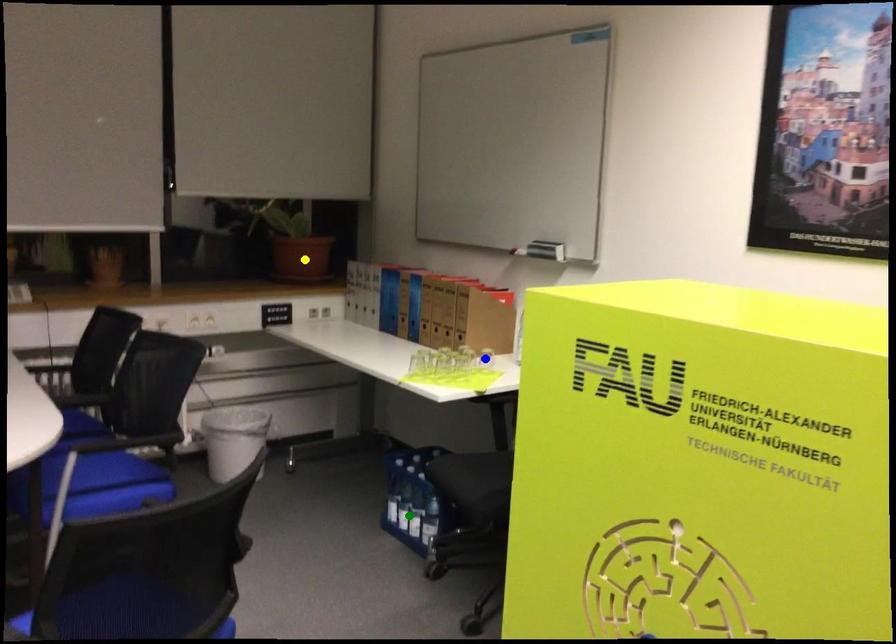
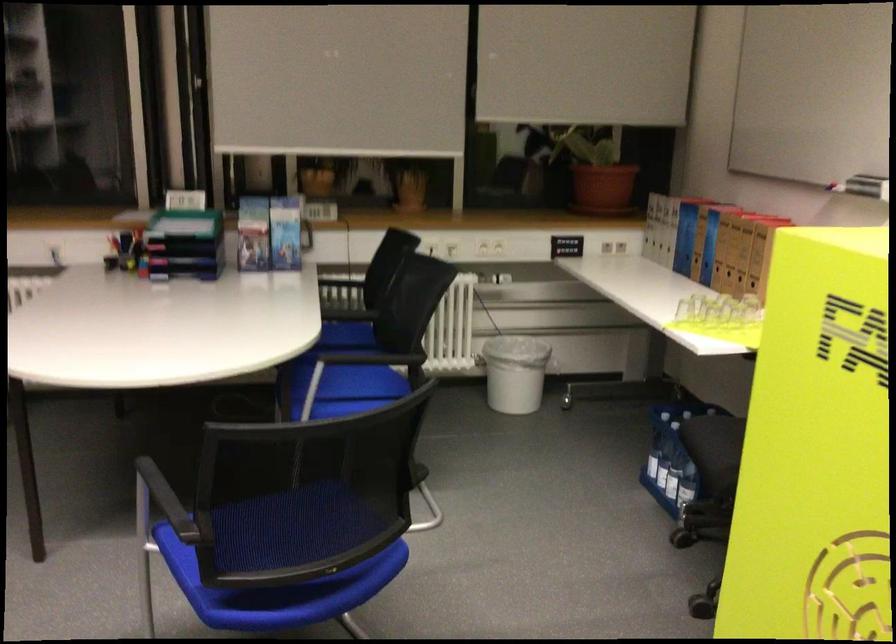
I am providing you with two images of the same scene from different viewpoints. Three points are marked in image1. Which point corresponds to a part or object that is occluded in image2?In image1, three points are marked. Which of them correspond to a part or object that is occluded in image2?Among the three points shown in image1, which one corresponds to a part or object that is no longer visible due to occlusion in image2?

Invisible in image2: blue point.